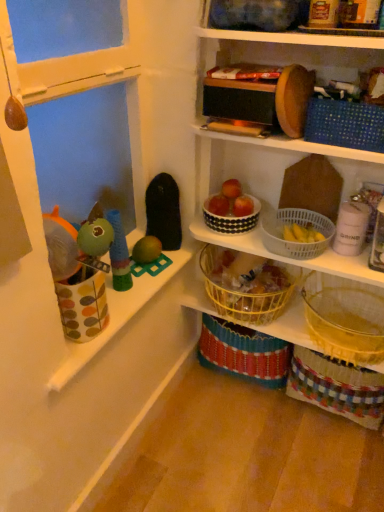
Question: From the image's perspective, does white dotted bowl at center, arranged as the fourth basket when ordered from the bottom, appear lower than red matte apple at upper center, which is the second apple from right to left?

Choices:
 (A) yes
 (B) no

Answer: (A)

Question: Is white dotted bowl at center, placed as the second basket when sorted from top to bottom, closer to camera compared to red matte apple at upper center, the second apple positioned from the left?

Choices:
 (A) no
 (B) yes

Answer: (B)

Question: Is white dotted bowl at center, arranged as the fourth basket when ordered from the bottom, bigger than red matte apple at upper center, the second apple positioned from the left?

Choices:
 (A) no
 (B) yes

Answer: (B)

Question: Is white dotted bowl at center, arranged as the fourth basket when ordered from the bottom, thinner than red matte apple at upper center, the second apple positioned from the left?

Choices:
 (A) yes
 (B) no

Answer: (B)

Question: Is white dotted bowl at center, placed as the second basket when sorted from top to bottom, positioned far away from red matte apple at upper center, which is the second apple from right to left?

Choices:
 (A) yes
 (B) no

Answer: (B)

Question: From the image's perspective, is yellow wire basket at center, which is counted as the second basket, starting from the bottom, located above or below green rubber toy at center, which is the 3th toy in left-to-right order?

Choices:
 (A) above
 (B) below

Answer: (B)

Question: From a real-world perspective, is yellow wire basket at center, the 4th basket positioned from the top, above or below green rubber toy at center, the 4th toy from the right?

Choices:
 (A) above
 (B) below

Answer: (B)

Question: Is yellow wire basket at center, which is counted as the second basket, starting from the bottom, situated inside green rubber toy at center, the 4th toy from the right, or outside?

Choices:
 (A) outside
 (B) inside

Answer: (A)

Question: Is yellow wire basket at center, the 4th basket positioned from the top, wider or thinner than green rubber toy at center, which is the 3th toy in left-to-right order?

Choices:
 (A) wide
 (B) thin

Answer: (A)

Question: From the image's perspective, is wooden toy at upper right, the third toy when ordered from right to left, positioned above or below red matte apple at upper center, which is the second apple from right to left?

Choices:
 (A) above
 (B) below

Answer: (A)

Question: Is point (307, 26) positioned closer to the camera than point (226, 188)?

Choices:
 (A) farther
 (B) closer

Answer: (B)

Question: Is wooden toy at upper right, the third toy when ordered from right to left, inside or outside of red matte apple at upper center, which is the second apple from right to left?

Choices:
 (A) inside
 (B) outside

Answer: (B)

Question: In terms of size, does wooden toy at upper right, the third toy when ordered from right to left, appear bigger or smaller than red matte apple at upper center, which is the second apple from right to left?

Choices:
 (A) big
 (B) small

Answer: (A)

Question: Considering the positions of blue dotted fabric basket at upper right, the 1th basket positioned from the top, and yellow woven basket at lower right, which appears as the 5th basket when viewed from the top, in the image, is blue dotted fabric basket at upper right, the 1th basket positioned from the top, bigger or smaller than yellow woven basket at lower right, which appears as the 5th basket when viewed from the top,?

Choices:
 (A) big
 (B) small

Answer: (B)

Question: From a real-world perspective, is blue dotted fabric basket at upper right, which is the 5th basket in bottom-to-top order, above or below yellow woven basket at lower right, which appears as the 5th basket when viewed from the top?

Choices:
 (A) above
 (B) below

Answer: (A)